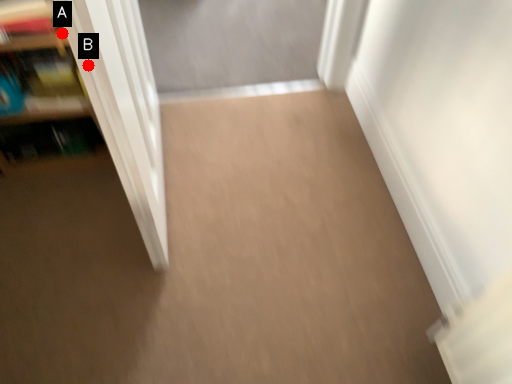
Question: Two points are circled on the image, labeled by A and B beside each circle. Which point is farther from the camera taking this photo?

Choices:
 (A) A is further
 (B) B is further

Answer: (A)